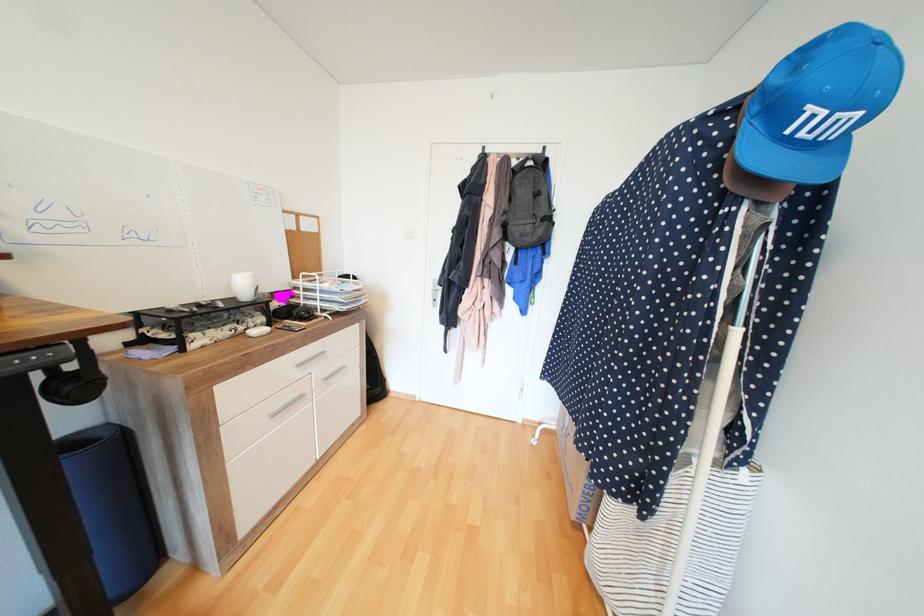
The height and width of the screenshot is (616, 924). What do you see at coordinates (287, 407) in the screenshot? I see `the silver drawer handle` at bounding box center [287, 407].